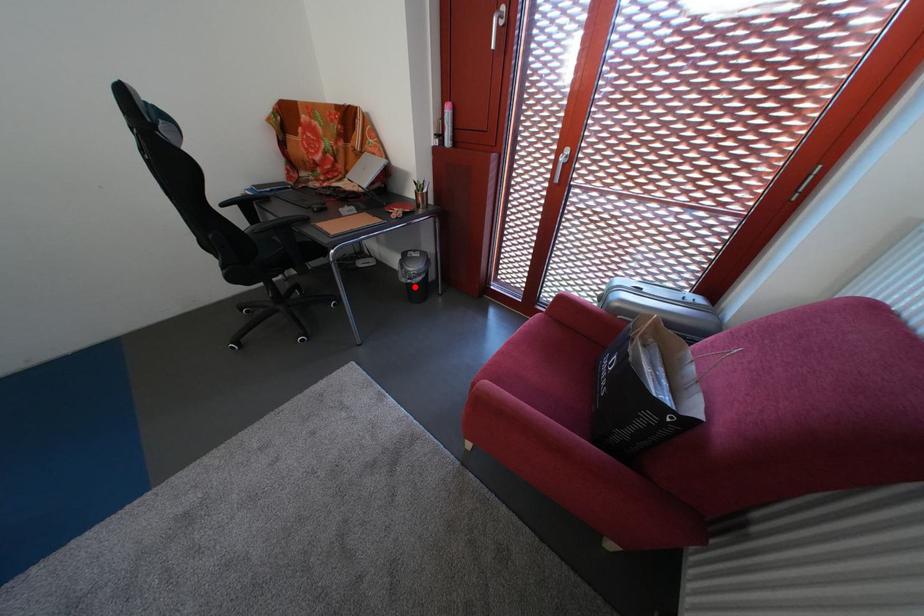
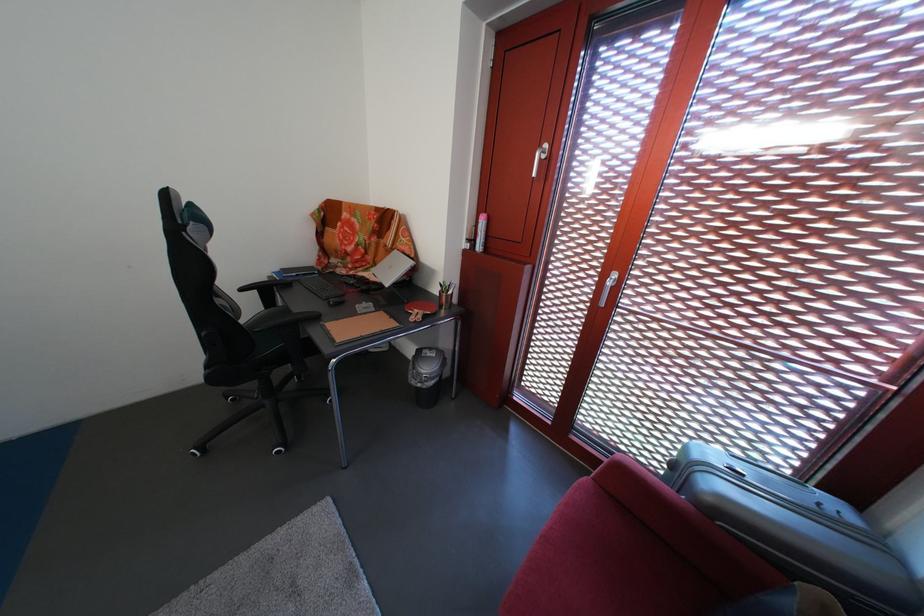
In the second image, find the point that corresponds to the highlighted location in the first image.

(424, 389)